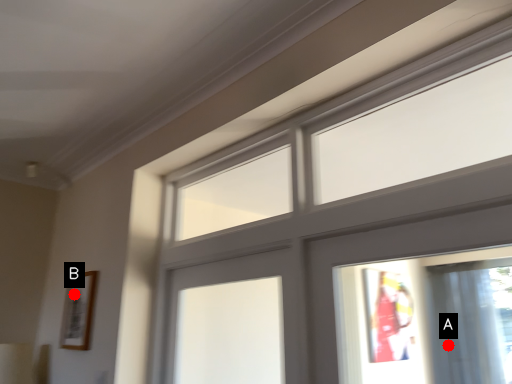
Question: Two points are circled on the image, labeled by A and B beside each circle. Which point is closer to the camera?

Choices:
 (A) A is closer
 (B) B is closer

Answer: (B)